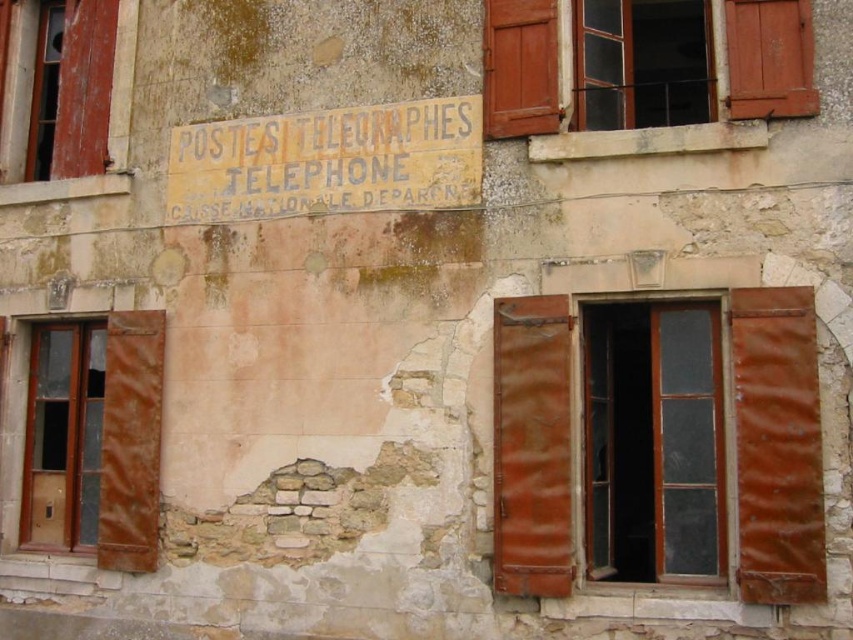
You are standing in front of an old stone building. There is a point marked at coordinates (80, 449) on the wall. If you want to touch this point with a 10 meter long pole, will you be able to reach it?

The point at (80, 449) is 9.69 meters away from the viewer. Since the pole is 10 meters long, you can just barely reach it with the pole.

You are standing in front of the old stone building and want to look through the windows. Which window, the matte wooden window at left or the wooden shuttered window at left, can you see more clearly?

The matte wooden window at left is closer to the viewer than the wooden shuttered window at left, so you can see the matte wooden window at left more clearly.

You are a delivery person trying to deliver a package to the address shown in the image. You notice both the transparent glass window at center and the rusty metal shutter at center. Which object is located higher up on the building?

The transparent glass window at center is positioned over the rusty metal shutter at center, meaning it is higher up on the building.